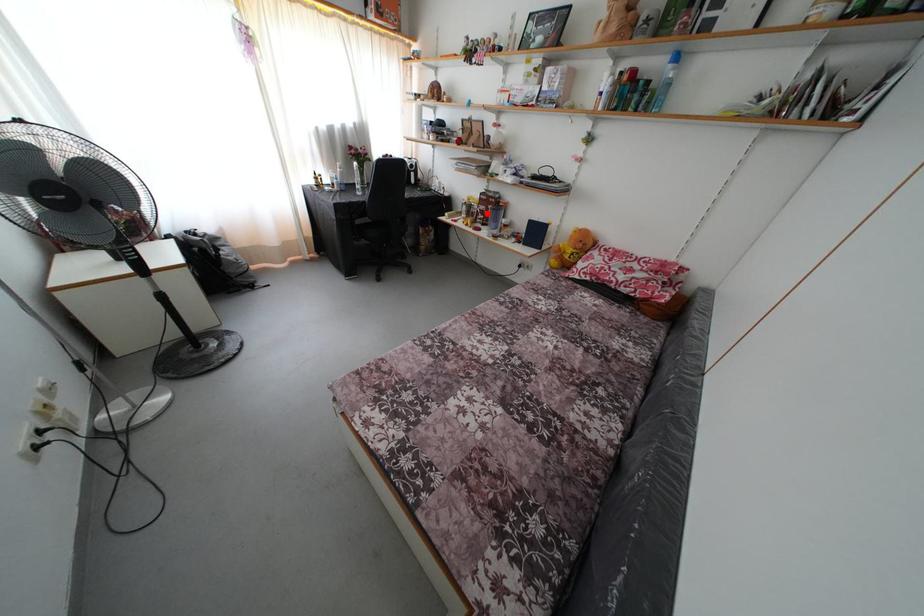
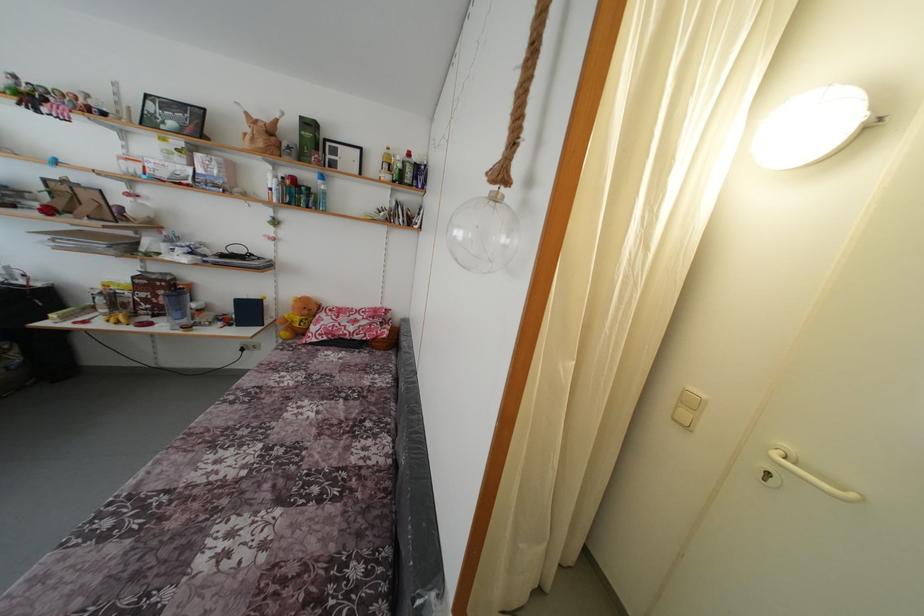
Find the pixel in the second image that matches the highlighted location in the first image.

(149, 301)